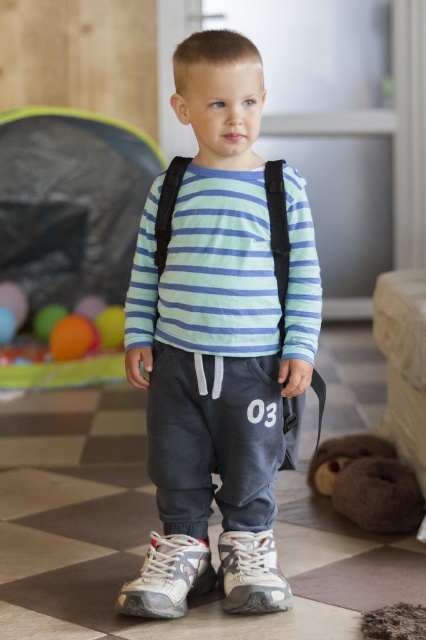
You are a photographer standing 5 feet away from the white mesh shoe at lower center. Can you adjust your position to get the shoe in focus without moving it?

The white mesh shoe at lower center is 6.08 feet away from the viewer. Since you are already 5 feet away, you need to move back 1.08 feet to match the distance and focus on the shoe.

You are taking a photo of the child and need to ensure the brown plush toy at lower right is visible in the frame. Based on its 2D coordinates, is the toy positioned within the standard camera frame boundaries?

The brown plush toy at lower right is located at 2D coordinates point (368, 483), which falls within the standard camera frame boundaries.

You are taking a photo of the child wearing the matte gray sweatpants at center. Based on the coordinates provided, where exactly is the matte gray sweatpants positioned in the image?

The matte gray sweatpants at center is positioned at coordinates point (218, 340).